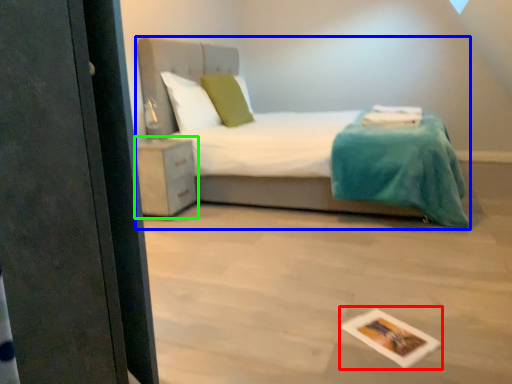
Question: Considering the real-world distances, which object is closest to postcard (highlighted by a red box)? bed (highlighted by a blue box) or nightstand (highlighted by a green box).

Choices:
 (A) bed
 (B) nightstand

Answer: (A)